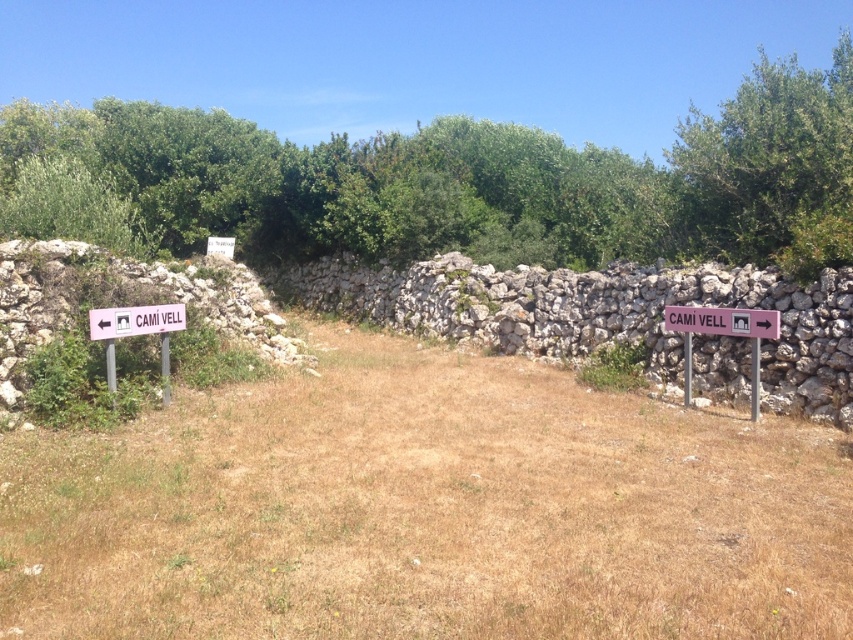
Question: Which point appears farthest from the camera in this image?

Choices:
 (A) (111, 308)
 (B) (689, 332)

Answer: (B)

Question: Is pink plastic sign at right wider than pink plastic sign at left?

Choices:
 (A) yes
 (B) no

Answer: (A)

Question: Which object is closer to the camera taking this photo?

Choices:
 (A) pink plastic sign at right
 (B) pink plastic sign at left

Answer: (B)

Question: Which of the following is the closest to the observer?

Choices:
 (A) 119,308
 (B) 757,320

Answer: (A)

Question: Does pink plastic sign at right have a smaller size compared to pink plastic sign at left?

Choices:
 (A) no
 (B) yes

Answer: (A)

Question: Observing the image, what is the correct spatial positioning of pink plastic sign at right in reference to pink plastic sign at left?

Choices:
 (A) above
 (B) below

Answer: (B)